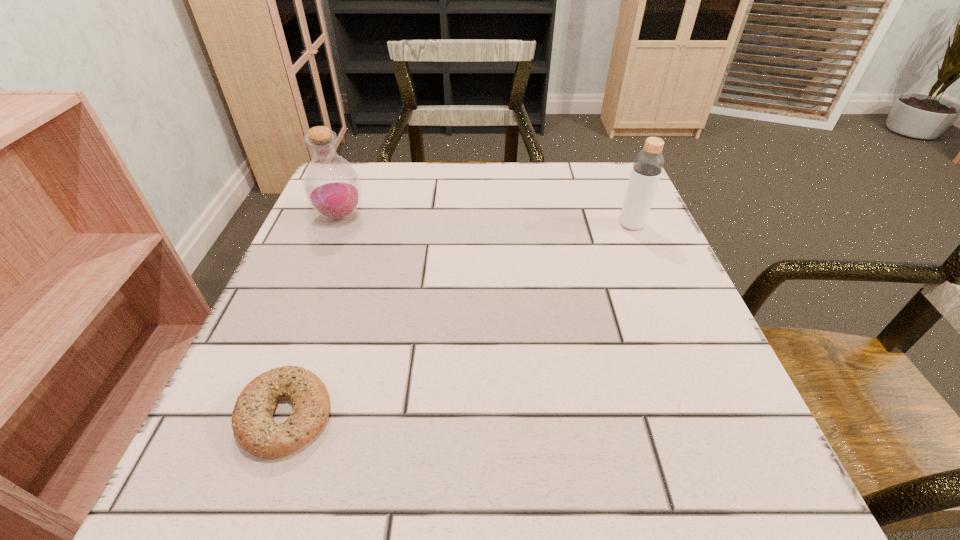
Identify the location of bagel situated at the left edge. The image size is (960, 540). (252, 421).

This screenshot has height=540, width=960. What are the coordinates of `object that is at the right edge` in the screenshot? It's located at (648, 164).

Identify the location of object at the far left corner. The image size is (960, 540). (332, 187).

Identify the location of object situated at the near left corner. (252, 421).

Find the location of a particular element. The height and width of the screenshot is (540, 960). blank space at the far edge is located at coordinates (550, 174).

Find the location of a particular element. The width and height of the screenshot is (960, 540). vacant space at the near edge of the desktop is located at coordinates (331, 503).

The image size is (960, 540). In the image, there is a desktop. In order to click on free space at the left edge in this screenshot , I will do `click(271, 362)`.

The width and height of the screenshot is (960, 540). In order to click on vacant space at the right edge in this screenshot , I will do `click(607, 253)`.

Locate an element on the screen. Image resolution: width=960 pixels, height=540 pixels. vacant region at the far left corner of the desktop is located at coordinates (373, 189).

Locate an element on the screen. Image resolution: width=960 pixels, height=540 pixels. vacant space at the far right corner is located at coordinates (600, 198).